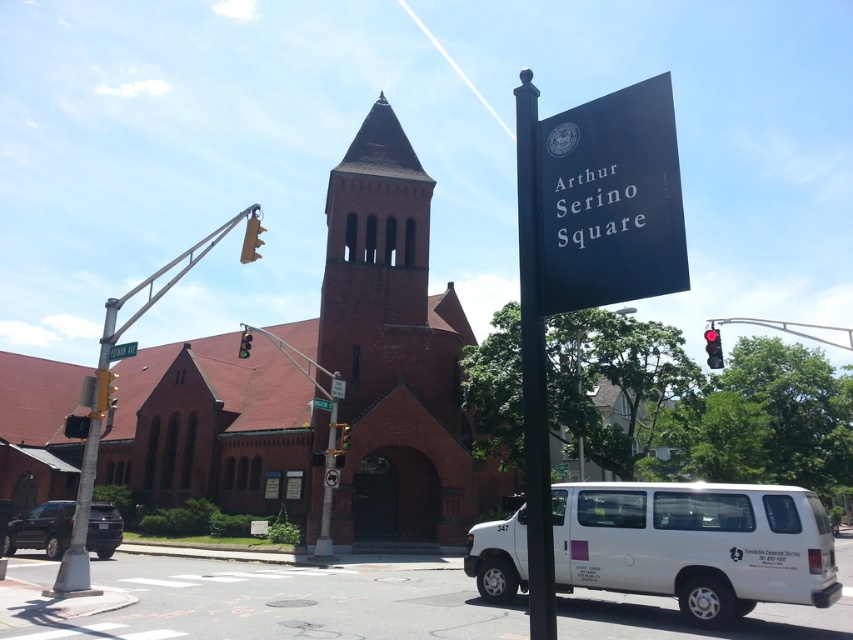
Question: Is metallic gray traffic light pole at left to the right of metallic yellow traffic light at upper left from the viewer's perspective?

Choices:
 (A) no
 (B) yes

Answer: (A)

Question: Which point is farther to the camera?

Choices:
 (A) green glass traffic light at upper center
 (B) yellow plastic traffic light at left
 (C) metallic yellow traffic light at upper left

Answer: (A)

Question: Among these points, which one is farthest from the camera?

Choices:
 (A) (311, 401)
 (B) (705, 346)
 (C) (103, 340)

Answer: (B)

Question: Does metallic gray traffic light pole at left have a larger size compared to yellow plastic traffic light at left?

Choices:
 (A) yes
 (B) no

Answer: (A)

Question: Which object is farther from the camera taking this photo?

Choices:
 (A) green plastic street sign at center
 (B) green metallic street sign at center
 (C) green glass traffic light at upper center
 (D) green metal street sign at upper center

Answer: (A)

Question: Can you confirm if green metal street sign at upper center is smaller than green glass traffic light at upper center?

Choices:
 (A) yes
 (B) no

Answer: (A)